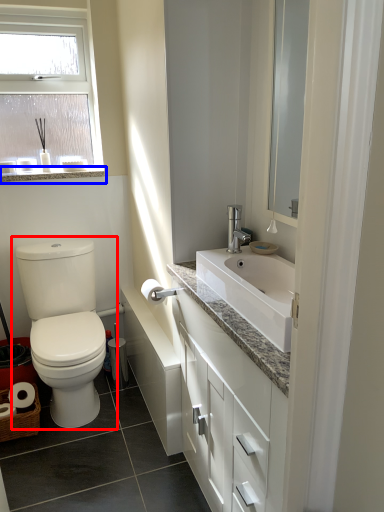
Question: Which point is further to the camera, toilet (highlighted by a red box) or window sill (highlighted by a blue box)?

Choices:
 (A) toilet
 (B) window sill

Answer: (B)